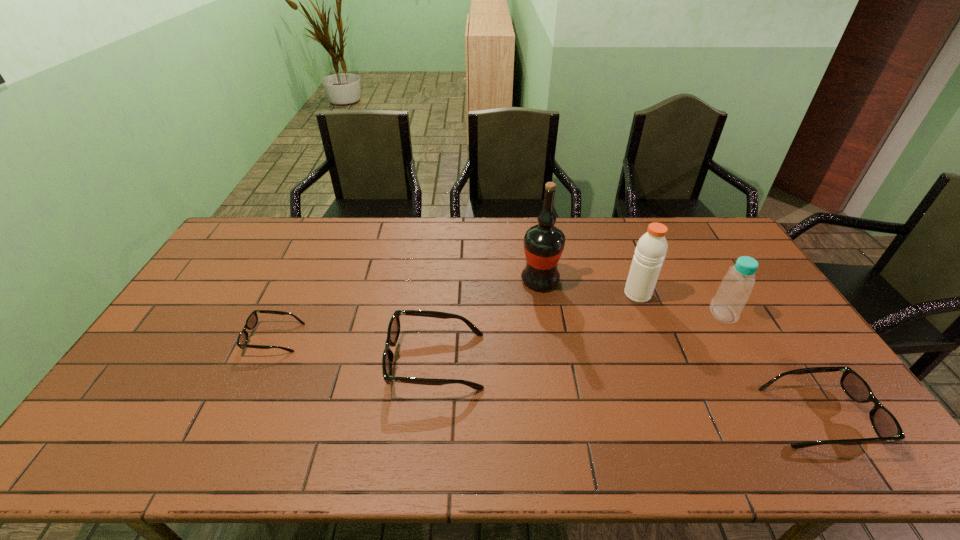
The height and width of the screenshot is (540, 960). What are the coordinates of `unoccupied area between the second spectacles from left to right and the second tallest spectacles` in the screenshot? It's located at (627, 389).

Where is `vacant point located between the tallest object and the shortest spectacles`? vacant point located between the tallest object and the shortest spectacles is located at coordinates (407, 309).

Image resolution: width=960 pixels, height=540 pixels. In order to click on free area in between the second spectacles from right to left and the fourth object from left to right in this screenshot , I will do `click(537, 328)`.

The height and width of the screenshot is (540, 960). Identify the location of free space between the shortest spectacles and the fourth shortest object. (498, 326).

At what (x,y) coordinates should I click in order to perform the action: click on unoccupied area between the leftmost object and the fourth shortest object. Please return your answer as a coordinate pair (x, y). Looking at the image, I should click on (498, 326).

Find the location of a particular element. vacant space that is in between the leftmost object and the second object from left to right is located at coordinates tap(355, 350).

In order to click on free space between the second tallest spectacles and the third tallest object in this screenshot , I will do `click(770, 365)`.

Locate an element on the screen. free space between the second tallest spectacles and the shortest object is located at coordinates (546, 377).

Where is `object that is the third nearest to the bottle`? object that is the third nearest to the bottle is located at coordinates (544, 243).

Where is `object that is the second closest to the tallest object`? The width and height of the screenshot is (960, 540). object that is the second closest to the tallest object is located at coordinates (393, 332).